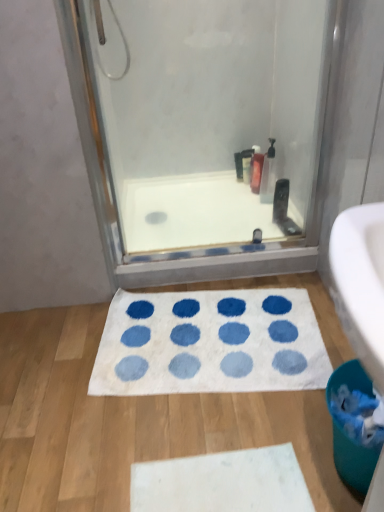
Image resolution: width=384 pixels, height=512 pixels. Identify the location of matte black bottle at upper center. (246, 164).

The width and height of the screenshot is (384, 512). Find the location of `white soft bath mat at center`. white soft bath mat at center is located at coordinates (210, 343).

From a real-world perspective, who is located higher, transparent glass shower door at upper center or matte black bottle at upper center?

transparent glass shower door at upper center, from a real-world perspective.

Is transparent glass shower door at upper center at the right side of matte black bottle at upper center?

No, transparent glass shower door at upper center is not to the right of matte black bottle at upper center.

Could you tell me if transparent glass shower door at upper center is facing matte black bottle at upper center?

No, transparent glass shower door at upper center is not turned towards matte black bottle at upper center.

Is point (98, 161) less distant than point (244, 159)?

Yes, it is in front of point (244, 159).

Is white soft bath mat at center at the back of matte black bottle at upper center?

No, matte black bottle at upper center's orientation is not away from white soft bath mat at center.

Does matte black bottle at upper center have a lesser height compared to white soft bath mat at center?

Incorrect, the height of matte black bottle at upper center does not fall short of that of white soft bath mat at center.

From a real-world perspective, which is physically below, matte black bottle at upper center or white soft bath mat at center?

In real-world perspective, white soft bath mat at center is lower.

Would you say teal plastic toilet bowl at lower right is outside white smooth bathtub at center?

Yes, teal plastic toilet bowl at lower right is outside of white smooth bathtub at center.

Are teal plastic toilet bowl at lower right and white smooth bathtub at center located far from each other?

teal plastic toilet bowl at lower right is actually quite close to white smooth bathtub at center.

The height and width of the screenshot is (512, 384). Find the location of `bath above the teal plastic toilet bowl at lower right (from the image's perspective)`. bath above the teal plastic toilet bowl at lower right (from the image's perspective) is located at coordinates 193,213.

How much distance is there between white soft bath mat at center and white smooth bathtub at center?

A distance of 15.59 inches exists between white soft bath mat at center and white smooth bathtub at center.

From a real-world perspective, is white soft bath mat at center positioned over white smooth bathtub at center based on gravity?

No.

Would you say white soft bath mat at center contains white smooth bathtub at center?

Actually, white smooth bathtub at center is outside white soft bath mat at center.

Who is shorter, white soft bath mat at center or white smooth bathtub at center?

white soft bath mat at center.

You are a GUI agent. You are given a task and a screenshot of the screen. Output one action in this format:
    pyautogui.click(x=<x>, y=<y>)
    Task: Click on the toiletry above the teal plastic toilet bowl at lower right (from a real-world perspective)
    The width and height of the screenshot is (384, 512).
    Given the screenshot: What is the action you would take?
    pyautogui.click(x=246, y=164)

Is there a large distance between teal plastic toilet bowl at lower right and matte black bottle at upper center?

No, teal plastic toilet bowl at lower right is in close proximity to matte black bottle at upper center.

Considering the positions of objects teal plastic toilet bowl at lower right and matte black bottle at upper center in the image provided, who is more to the left, teal plastic toilet bowl at lower right or matte black bottle at upper center?

Positioned to the left is matte black bottle at upper center.

Does point (361, 429) come farther from viewer compared to point (246, 159)?

No, it is not.

Considering the sizes of translucent plastic bottle at upper center, which ranks as the second cleaning product in front-to-back order, and white soft bath mat at center in the image, is translucent plastic bottle at upper center, which ranks as the second cleaning product in front-to-back order, taller or shorter than white soft bath mat at center?

In the image, translucent plastic bottle at upper center, which ranks as the second cleaning product in front-to-back order, appears to be taller than white soft bath mat at center.

Is translucent plastic bottle at upper center, the first cleaning product viewed from the back, behind white soft bath mat at center?

Yes.

How much distance is there between translucent plastic bottle at upper center, the first cleaning product viewed from the back, and white soft bath mat at center?

The distance of translucent plastic bottle at upper center, the first cleaning product viewed from the back, from white soft bath mat at center is 25.53 inches.

Is translucent plastic bottle at upper center, the first cleaning product viewed from the back, smaller than white soft bath mat at center?

Correct, translucent plastic bottle at upper center, the first cleaning product viewed from the back, occupies less space than white soft bath mat at center.

From the picture: Is transparent glass shower door at upper center directly adjacent to teal plastic toilet bowl at lower right?

transparent glass shower door at upper center and teal plastic toilet bowl at lower right are clearly separated.

From a real-world perspective, is transparent glass shower door at upper center physically above teal plastic toilet bowl at lower right?

Yes, from a real-world perspective, transparent glass shower door at upper center is above teal plastic toilet bowl at lower right.

From the image's perspective, which object appears higher, transparent glass shower door at upper center or teal plastic toilet bowl at lower right?

transparent glass shower door at upper center is shown above in the image.

Looking at this image, which is more to the right, transparent glass shower door at upper center or teal plastic toilet bowl at lower right?

Positioned to the right is teal plastic toilet bowl at lower right.

Locate an element on the screen. toiletry lying behind the transparent glass shower door at upper center is located at coordinates (246, 164).

I want to click on toiletry that appears above the white soft bath mat at center (from the image's perspective), so click(246, 164).

From the image, which object appears to be farther from transparent glass shower door at upper center, matte black bottle at upper center or white soft bath mat at center?

white soft bath mat at center is further to transparent glass shower door at upper center.

From the picture: Estimate the real-world distances between objects in this image. Which object is closer to translucent plastic bottle at upper center, which ranks as the second cleaning product in front-to-back order, teal plastic toilet bowl at lower right or white smooth bathtub at center?

The object closer to translucent plastic bottle at upper center, which ranks as the second cleaning product in front-to-back order, is white smooth bathtub at center.

From the picture: Which object lies further to the anchor point white soft bath mat at center, white smooth bathtub at center or clear plastic pump bottle at upper right, which is counted as the second cleaning product, starting from the back?

The object further to white soft bath mat at center is clear plastic pump bottle at upper right, which is counted as the second cleaning product, starting from the back.

Looking at the image, which one is located closer to transparent glass shower door at upper center, white soft bath mat at center or white smooth bathtub at center?

The object closer to transparent glass shower door at upper center is white smooth bathtub at center.

Looking at the image, which one is located further to white smooth bathtub at center, clear plastic pump bottle at upper right, acting as the first cleaning product starting from the front, or teal plastic toilet bowl at lower right?

Among the two, teal plastic toilet bowl at lower right is located further to white smooth bathtub at center.

When comparing their distances from transparent glass shower door at upper center, does white soft bath mat at center or teal plastic toilet bowl at lower right seem further?

teal plastic toilet bowl at lower right lies further to transparent glass shower door at upper center than the other object.

Based on their spatial positions, is translucent plastic bottle at upper center, the first cleaning product viewed from the back, or clear plastic pump bottle at upper right, acting as the first cleaning product starting from the front, further from white smooth bathtub at center?

The object further to white smooth bathtub at center is translucent plastic bottle at upper center, the first cleaning product viewed from the back.

Estimate the real-world distances between objects in this image. Which object is closer to translucent plastic bottle at upper center, which ranks as the second cleaning product in front-to-back order, matte black bottle at upper center or white smooth bathtub at center?

Among the two, matte black bottle at upper center is located nearer to translucent plastic bottle at upper center, which ranks as the second cleaning product in front-to-back order.

This screenshot has height=512, width=384. Identify the location of bath located between white soft bath mat at center and matte black bottle at upper center in the depth direction. (193, 213).

The width and height of the screenshot is (384, 512). Identify the location of bath mat between transparent glass shower door at upper center and clear plastic pump bottle at upper right, which is counted as the second cleaning product, starting from the back, along the z-axis. (210, 343).

Identify the location of bath between clear plastic pump bottle at upper right, which is counted as the second cleaning product, starting from the back, and white soft bath mat at center vertically. (193, 213).

At what (x,y) coordinates should I click in order to perform the action: click on bath mat located between teal plastic toilet bowl at lower right and clear plastic pump bottle at upper right, acting as the first cleaning product starting from the front, in the depth direction. Please return your answer as a coordinate pair (x, y). This screenshot has width=384, height=512. Looking at the image, I should click on (210, 343).